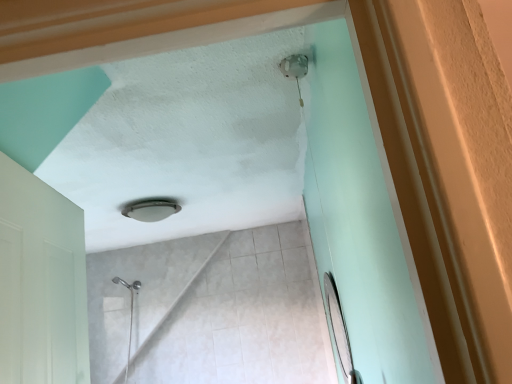
Question: Considering the positions of matte silver mirror at right and matte glass lamp at center in the image, is matte silver mirror at right bigger or smaller than matte glass lamp at center?

Choices:
 (A) big
 (B) small

Answer: (A)

Question: Considering the positions of matte silver mirror at right and matte glass lamp at center in the image, is matte silver mirror at right wider or thinner than matte glass lamp at center?

Choices:
 (A) wide
 (B) thin

Answer: (B)

Question: Is matte silver mirror at right to the left or to the right of matte glass lamp at center in the image?

Choices:
 (A) right
 (B) left

Answer: (A)

Question: Based on their sizes in the image, would you say matte glass lamp at center is bigger or smaller than matte silver mirror at right?

Choices:
 (A) small
 (B) big

Answer: (A)

Question: Considering the positions of matte glass lamp at center and matte silver mirror at right in the image, is matte glass lamp at center wider or thinner than matte silver mirror at right?

Choices:
 (A) wide
 (B) thin

Answer: (A)

Question: In the image, is matte glass lamp at center positioned in front of or behind matte silver mirror at right?

Choices:
 (A) behind
 (B) front

Answer: (A)

Question: From a real-world perspective, relative to matte silver mirror at right, is matte glass lamp at center vertically above or below?

Choices:
 (A) below
 (B) above

Answer: (B)